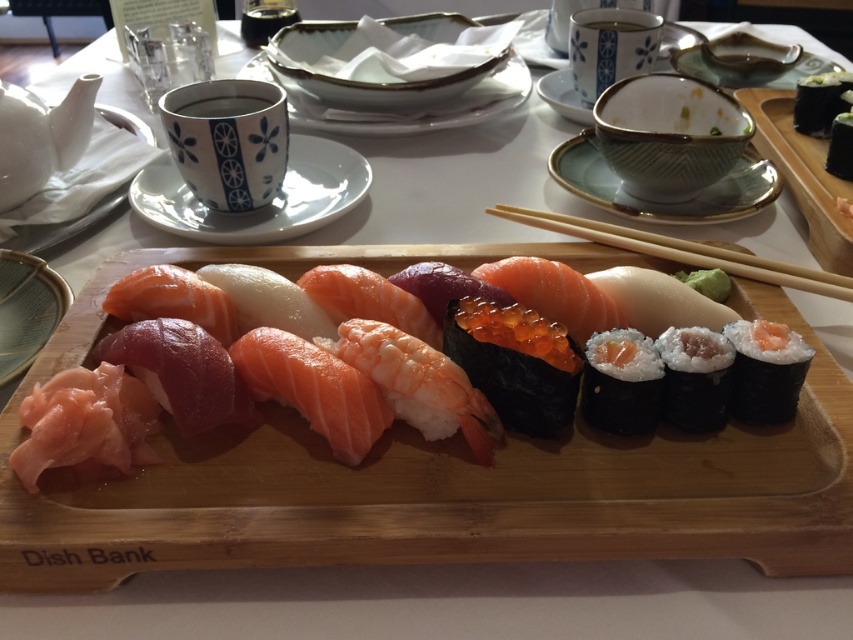
Question: Based on their relative distances, which object is farther from the white ceramic cup at upper left?

Choices:
 (A) white rice at center
 (B) porcelain bowl at upper center
 (C) white ceramic teapot at upper left
 (D) white porcelain plate at upper center

Answer: (A)

Question: Which of the following is the closest to the observer?

Choices:
 (A) (292, 90)
 (B) (572, 234)

Answer: (B)

Question: In this image, where is white ceramic plate at upper center located relative to porcelain bowl at upper center?

Choices:
 (A) above
 (B) below

Answer: (B)

Question: Does wooden tray at center have a smaller size compared to matte glass plate at lower left?

Choices:
 (A) yes
 (B) no

Answer: (B)

Question: Is white ceramic teapot at upper left wider than matte ceramic bowl at upper right?

Choices:
 (A) yes
 (B) no

Answer: (B)

Question: Which of these objects is positioned closest to the porcelain bowl at upper right?

Choices:
 (A) white rice roll at center
 (B) wooden chopsticks at upper center

Answer: (B)